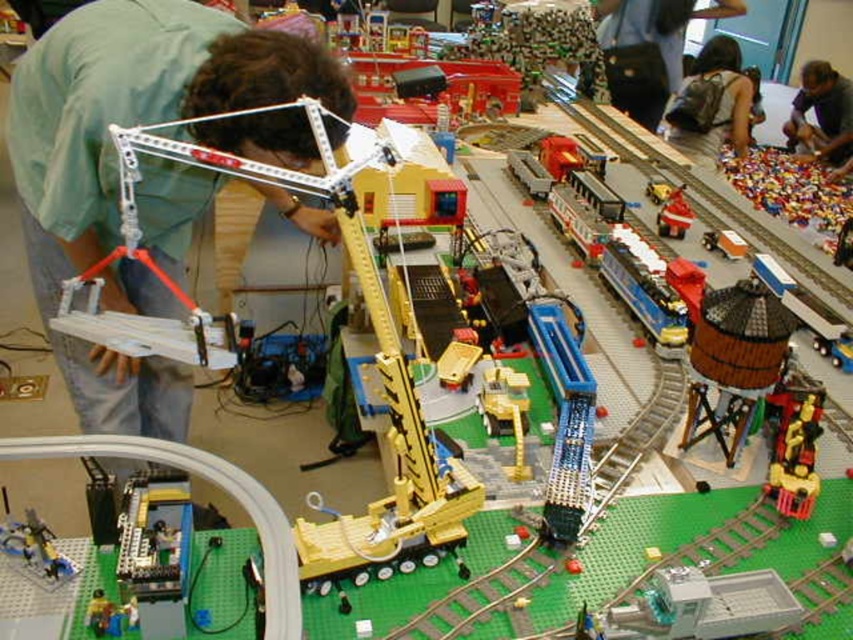
You are a delivery robot that needs to transport a package from the dark brown backpack at upper right to the red matte train at center. The maximum distance you can travel is 7 feet. Can you complete the delivery without exceeding your range?

The distance between the dark brown backpack at upper right and the red matte train at center is 7.54 feet, which exceeds the robot maximum travel distance of 7 feet. The delivery cannot be completed within the range.